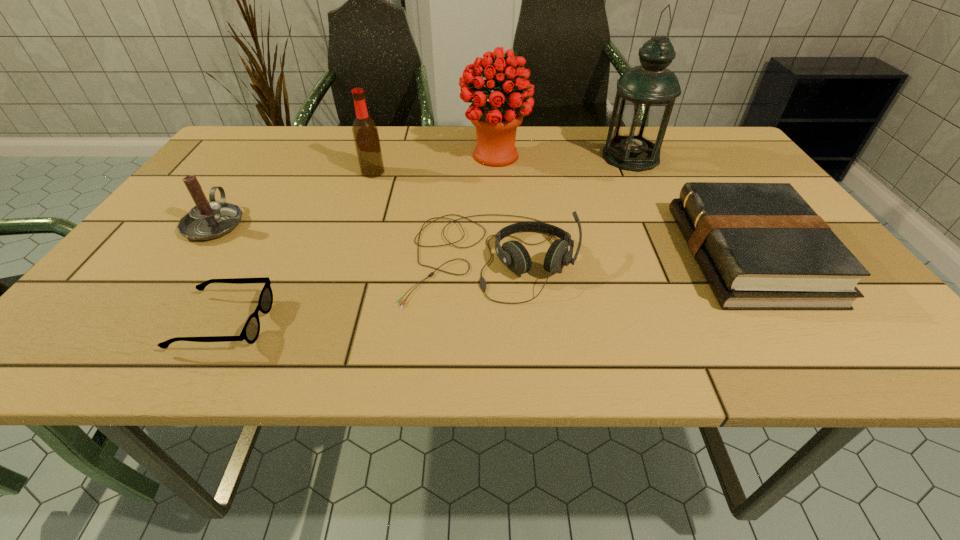
Find the location of `free spot located 0.380m on the left of the tallest object`. free spot located 0.380m on the left of the tallest object is located at coordinates (466, 157).

Identify the location of vacant space situated 0.370m on the right of the bouquet. This screenshot has height=540, width=960. (662, 156).

Identify the location of free space located 0.360m on the right of the third object from left to right. (521, 172).

This screenshot has width=960, height=540. In order to click on vacant space positioned on the side of the candle with the handle loop in this screenshot , I will do `click(271, 145)`.

Find the location of a particular element. The image size is (960, 540). blank area located on the side of the candle with the handle loop is located at coordinates (276, 137).

Identify the location of free spot located on the side of the candle with the handle loop. (245, 182).

Find the location of a particular element. The width and height of the screenshot is (960, 540). vacant position located 0.390m on the spine side of the hardback book is located at coordinates (503, 255).

Where is `free location located 0.350m on the spine side of the hardback book`? The width and height of the screenshot is (960, 540). free location located 0.350m on the spine side of the hardback book is located at coordinates tap(522, 255).

The image size is (960, 540). What are the coordinates of `free space located 0.400m on the spine side of the hardback book` in the screenshot? It's located at (499, 255).

The image size is (960, 540). I want to click on vacant space located 0.240m on the arms of the spectacles, so click(x=398, y=323).